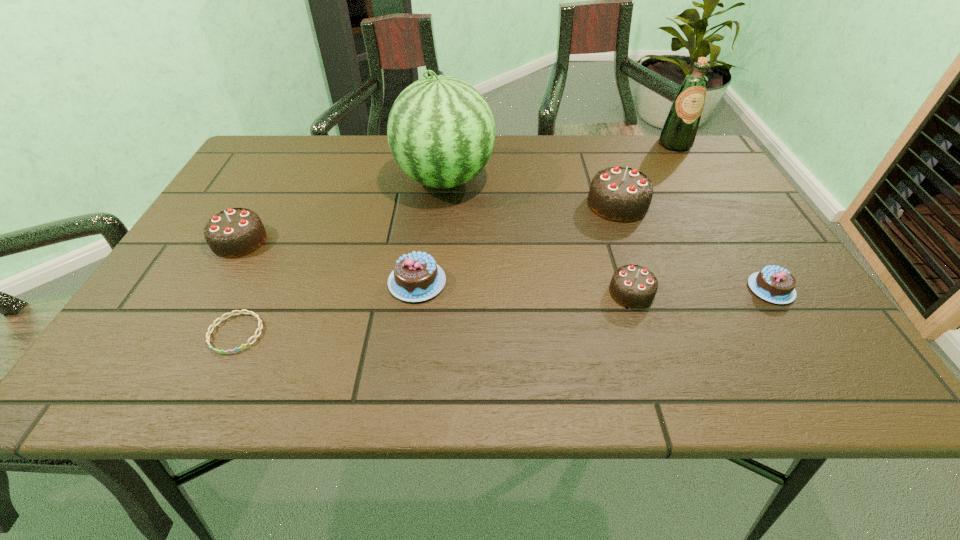
Image resolution: width=960 pixels, height=540 pixels. Find the location of `the tallest object`. the tallest object is located at coordinates (441, 132).

Where is `watermelon`? watermelon is located at coordinates (441, 132).

Where is `the farthest object`? The width and height of the screenshot is (960, 540). the farthest object is located at coordinates (678, 134).

I want to click on the second tallest object, so click(x=678, y=134).

The height and width of the screenshot is (540, 960). I want to click on the third tallest object, so click(x=622, y=194).

Where is `the biggest chocolate chocolate cake`? This screenshot has height=540, width=960. the biggest chocolate chocolate cake is located at coordinates click(622, 194).

The height and width of the screenshot is (540, 960). What are the coordinates of `the second smallest chocolate chocolate cake` in the screenshot? It's located at click(235, 232).

The height and width of the screenshot is (540, 960). I want to click on the second farthest chocolate chocolate cake, so click(235, 232).

Image resolution: width=960 pixels, height=540 pixels. I want to click on the bigger pink chocolate cake, so click(416, 277).

Image resolution: width=960 pixels, height=540 pixels. Find the location of `the fourth chocolate cake from right to left`. the fourth chocolate cake from right to left is located at coordinates tap(416, 277).